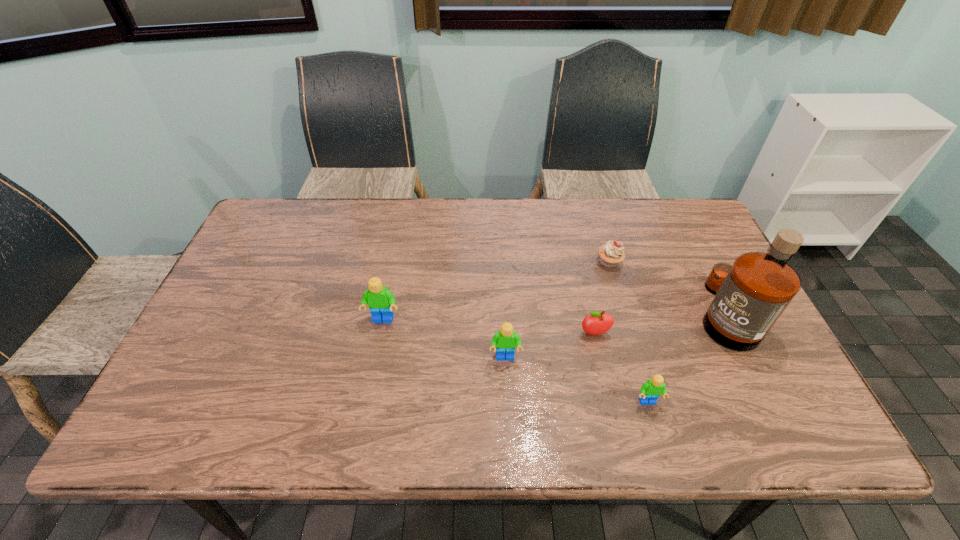
Where is `empty space that is in between the farthest object and the second nearest Lego`? empty space that is in between the farthest object and the second nearest Lego is located at coordinates (557, 310).

You are a GUI agent. You are given a task and a screenshot of the screen. Output one action in this format:
    pyautogui.click(x=<x>, y=<y>)
    Task: Click on the free spot between the liquor and the second shortest Lego
    
    Given the screenshot: What is the action you would take?
    pyautogui.click(x=614, y=335)

Where is `vacant region between the apple and the rightmost Lego`? This screenshot has height=540, width=960. vacant region between the apple and the rightmost Lego is located at coordinates (621, 368).

Locate an element on the screen. The image size is (960, 540). free area in between the fourth object from right to left and the tallest object is located at coordinates (660, 323).

Identify which object is located as the fourth nearest to the farthest object. Please provide its 2D coordinates. Your answer should be formatted as a tuple, i.e. [(x, y)], where the tuple contains the x and y coordinates of a point satisfying the conditions above.

[(650, 391)]

Choose which object is the second nearest neighbor to the second farthest Lego. Please provide its 2D coordinates. Your answer should be formatted as a tuple, i.e. [(x, y)], where the tuple contains the x and y coordinates of a point satisfying the conditions above.

[(380, 300)]

Locate an element on the screen. Lego object that ranks as the second closest to the shortest Lego is located at coordinates (380, 300).

The image size is (960, 540). What are the coordinates of `Lego that can be found as the second closest to the second Lego from right to left` in the screenshot? It's located at (650, 391).

Locate an element on the screen. This screenshot has width=960, height=540. free point that satisfies the following two spatial constraints: 1. on the face of the apple; 2. on the left side of the farthest Lego is located at coordinates (380, 334).

Where is `free region that satisfies the following two spatial constraints: 1. on the back side of the apple; 2. on the right side of the cupcake`? The image size is (960, 540). free region that satisfies the following two spatial constraints: 1. on the back side of the apple; 2. on the right side of the cupcake is located at coordinates (579, 262).